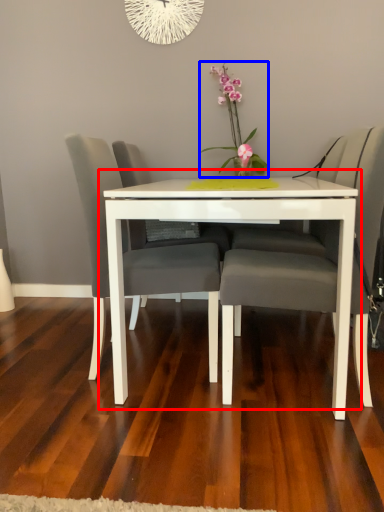
Question: Which of the following is the closest to the observer, table (highlighted by a red box) or floral arrangement (highlighted by a blue box)?

Choices:
 (A) table
 (B) floral arrangement

Answer: (A)